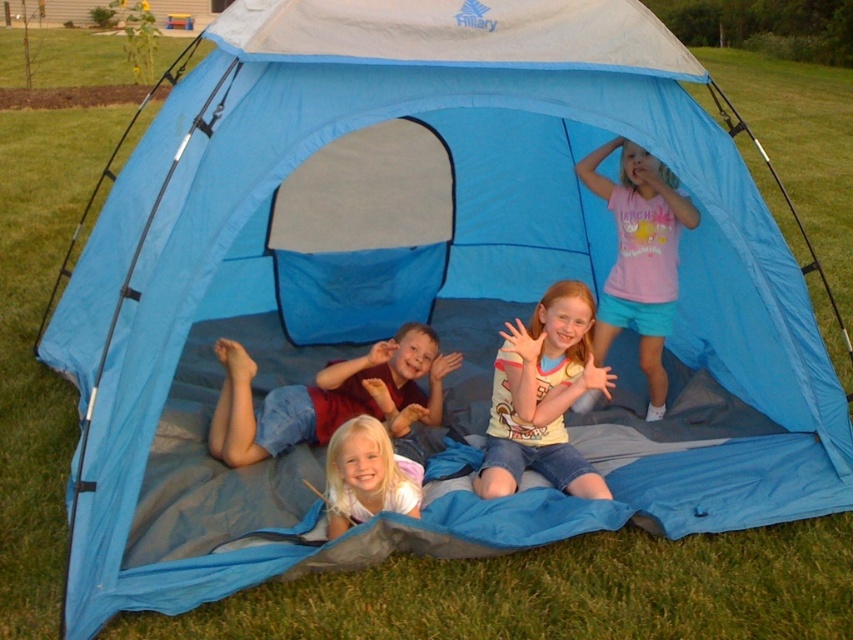
You are a photographer trying to capture a group photo of the children inside the blue pop up tent. You notice two shirts, the striped cotton shirt at center and the pink cotton shirt at upper center. Which shirt should you ask the child wearing to spread out more to ensure they fit comfortably in the photo?

The striped cotton shirt at center has a larger width than the pink cotton shirt at upper center, so the child wearing the striped cotton shirt at center should spread out more to ensure they fit comfortably in the photo.

You are standing outside the blue pop up tent and want to locate the child with light blonde hair at center. According to the coordinates provided, where should you look relative to the tent?

The light blonde hair at center is located at point (x=326, y=396), which means it is positioned at the center of the tent. So you should look towards the center of the tent to find the child with light blonde hair at center.